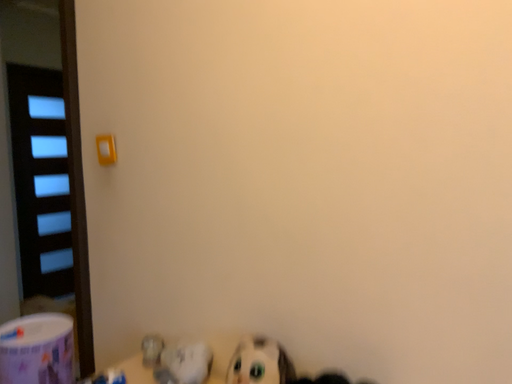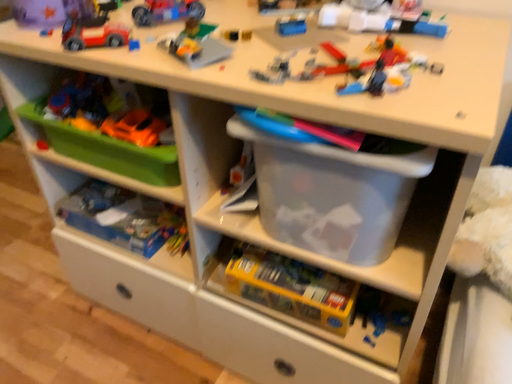
Question: Which way did the camera rotate in the video?

Choices:
 (A) rotated right
 (B) rotated left

Answer: (A)